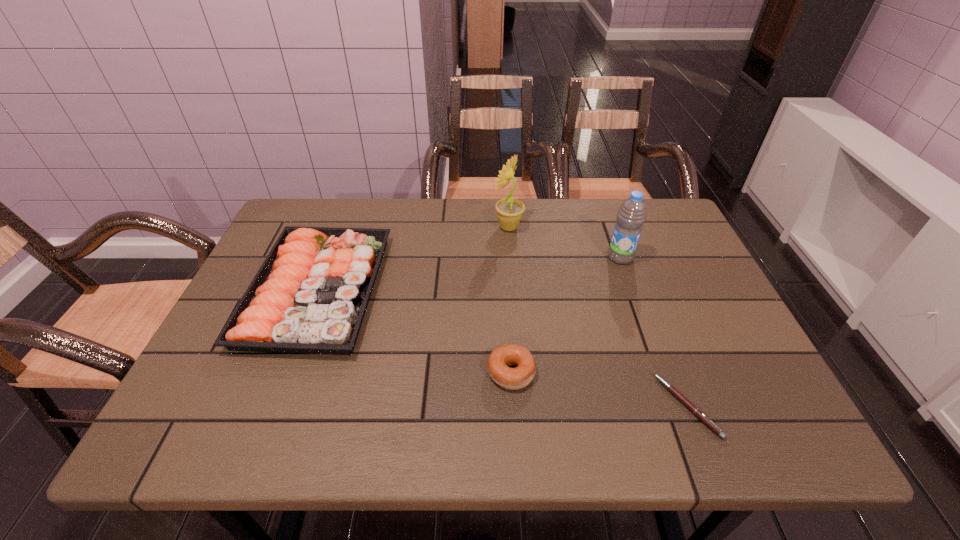
I want to click on vacant point located between the shortest object and the sunflower, so click(x=598, y=316).

What are the coordinates of `empty space between the water bottle and the third shortest object` in the screenshot? It's located at (468, 274).

Where is `empty location between the shortest object and the sunflower`? This screenshot has width=960, height=540. empty location between the shortest object and the sunflower is located at coordinates (x=598, y=316).

The image size is (960, 540). Identify the location of vacant point located between the sunflower and the second shortest object. (510, 300).

Locate an element on the screen. free point between the bagel and the water bottle is located at coordinates (565, 315).

The height and width of the screenshot is (540, 960). What are the coordinates of `vacant space in between the leftmost object and the fourth tallest object` in the screenshot? It's located at (414, 331).

The height and width of the screenshot is (540, 960). What are the coordinates of `free space between the bagel and the sunflower` in the screenshot? It's located at 510,300.

Locate an element on the screen. This screenshot has height=540, width=960. vacant space that is in between the third tallest object and the sunflower is located at coordinates (413, 259).

Identify which object is the second nearest to the water bottle. Please provide its 2D coordinates. Your answer should be formatted as a tuple, i.e. [(x, y)], where the tuple contains the x and y coordinates of a point satisfying the conditions above.

[(697, 412)]

Locate an element on the screen. object that is the fourth closest one to the shortest object is located at coordinates (310, 295).